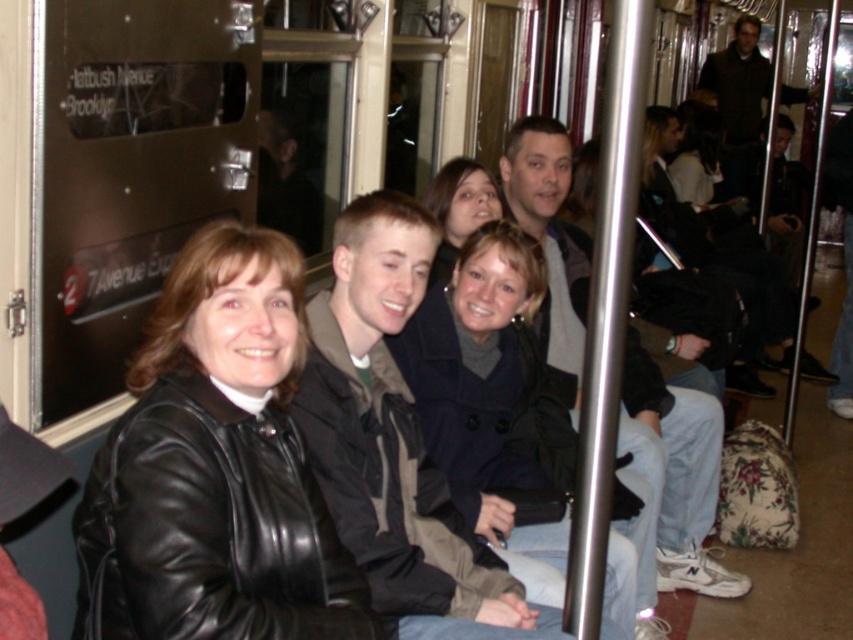
You are a photographer trying to capture a group photo of the black leather jacket at center and the dark brown sweater at upper right. Since you want to ensure both subjects are fully visible in the frame, which subject requires a wider angle lens to accommodate their size?

The dark brown sweater at upper right requires a wider angle lens because it has a greater width than the black leather jacket at center, necessitating a wider field of view to fully capture its size in the frame.

You are a photographer standing in the subway car and want to take a photo of both the black leather jacket at center and the dark brown sweater at upper right in the same frame. Given that your camera has a maximum focus range of 20 feet, will you be able to capture both subjects clearly in one shot?

The distance between the black leather jacket at center and the dark brown sweater at upper right is 21.50 feet, which exceeds the camera maximum focus range of 20 feet. Therefore, you cannot capture both subjects clearly in one shot.